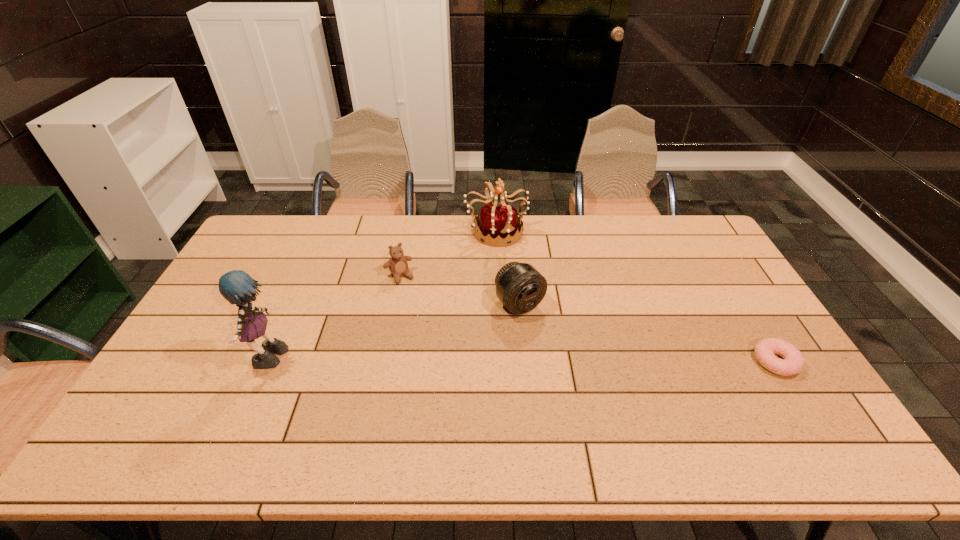
This screenshot has height=540, width=960. In order to click on free space between the rag doll and the fourth shortest object in this screenshot , I will do (382, 297).

At what (x,y) coordinates should I click in order to perform the action: click on unoccupied position between the fourth tallest object and the doughnut. Please return your answer as a coordinate pair (x, y). The height and width of the screenshot is (540, 960). Looking at the image, I should click on (588, 319).

Locate an element on the screen. The height and width of the screenshot is (540, 960). vacant space that is in between the tallest object and the teddy bear is located at coordinates (334, 319).

Where is `free area in between the tallest object and the rightmost object`? Image resolution: width=960 pixels, height=540 pixels. free area in between the tallest object and the rightmost object is located at coordinates (522, 362).

Find the location of a particular element. The height and width of the screenshot is (540, 960). blank region between the tiara and the fourth object from right to left is located at coordinates (447, 254).

This screenshot has height=540, width=960. In order to click on vacant area that lies between the rag doll and the rightmost object in this screenshot , I will do click(522, 362).

The height and width of the screenshot is (540, 960). Find the location of `free space that is in between the second tallest object and the teddy bear`. free space that is in between the second tallest object and the teddy bear is located at coordinates (447, 254).

Identify the location of free space between the tiara and the rag doll. (382, 297).

Locate an element on the screen. The height and width of the screenshot is (540, 960). vacant point located between the leftmost object and the third shortest object is located at coordinates (395, 333).

I want to click on the third closest object relative to the tallest object, so click(x=502, y=221).